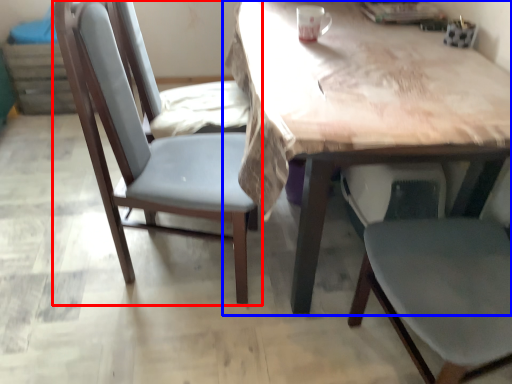
Question: Which object appears closest to the camera in this image, chair (highlighted by a red box) or table (highlighted by a blue box)?

Choices:
 (A) chair
 (B) table

Answer: (B)